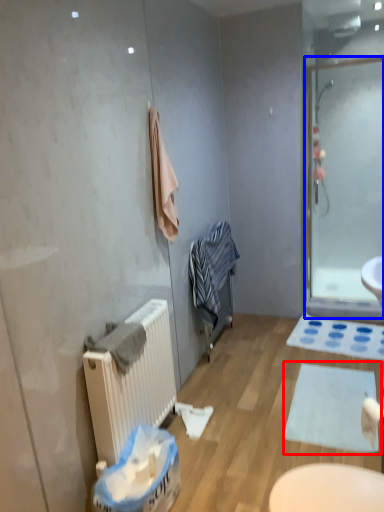
Question: Which object appears closest to the camera in this image, bath mat (highlighted by a red box) or screen door (highlighted by a blue box)?

Choices:
 (A) bath mat
 (B) screen door

Answer: (A)